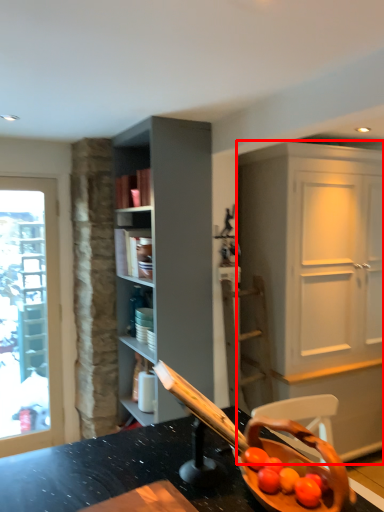
Question: Considering the relative positions of cabinetry (annotated by the red box) and shelf in the image provided, where is cabinetry (annotated by the red box) located with respect to the staircase?

Choices:
 (A) left
 (B) right

Answer: (B)